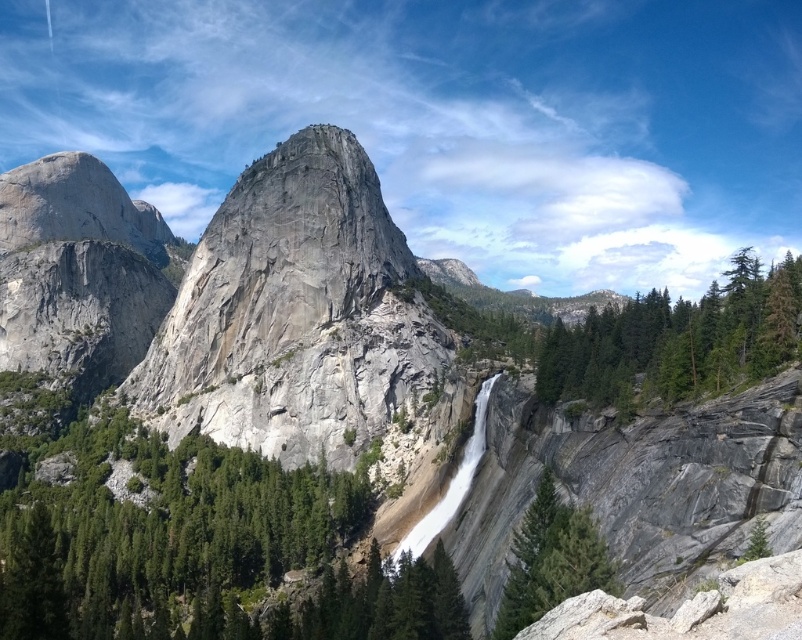
Is green textured rock at center behind green textured tree at right?

No.

Can you confirm if green textured rock at center is positioned above green textured tree at right?

No, green textured rock at center is not above green textured tree at right.

Is point (152, 579) positioned before point (622, 385)?

No, it is not.

I want to click on green textured rock at center, so click(x=196, y=545).

Does green textured rock at center appear on the left side of green textured rock at lower right?

Yes, green textured rock at center is to the left of green textured rock at lower right.

Which is below, green textured rock at center or green textured rock at lower right?

green textured rock at center is lower down.

Which is behind, point (209, 520) or point (608, 566)?

The point (209, 520) is more distant.

Where is `green textured rock at center`? Image resolution: width=802 pixels, height=640 pixels. green textured rock at center is located at coordinates (196, 545).

Image resolution: width=802 pixels, height=640 pixels. What do you see at coordinates (677, 339) in the screenshot?
I see `green textured tree at right` at bounding box center [677, 339].

Is green textured tree at right further to camera compared to green textured rock at lower right?

Yes, it is behind green textured rock at lower right.

I want to click on green textured tree at right, so click(x=677, y=339).